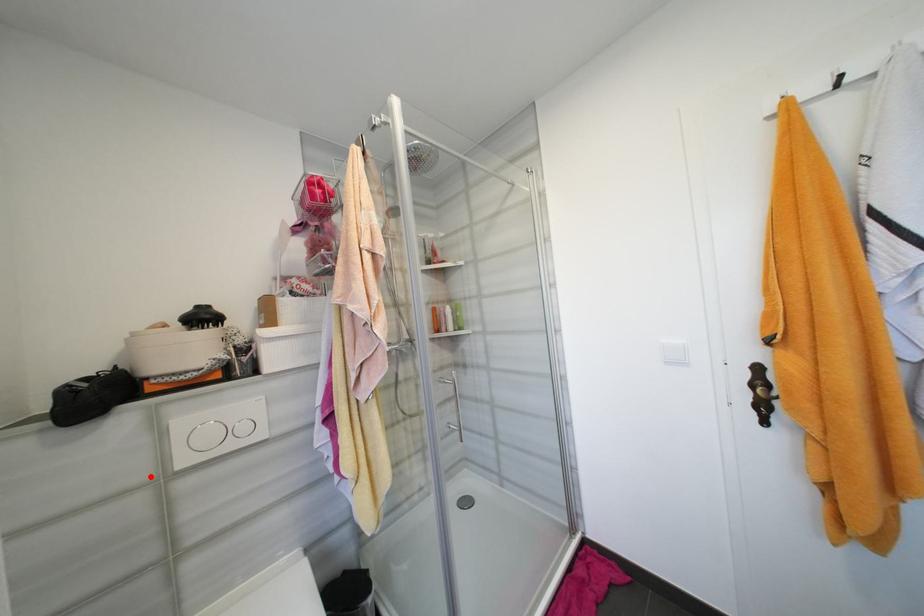
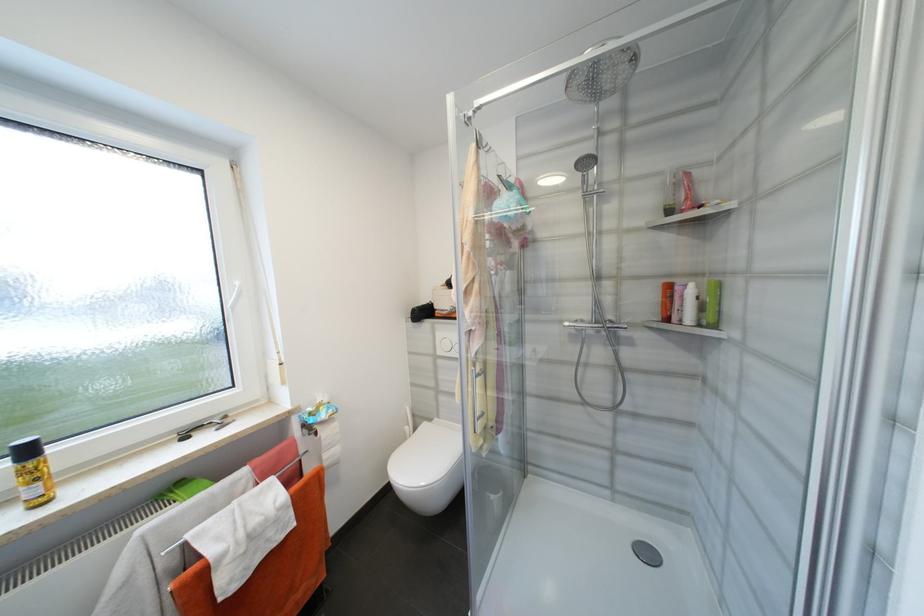
Question: I am providing you with two images of the same scene from different viewpoints. A red point is shown in image1. For the corresponding object point in image2, is it positioned nearer or farther from the camera?

Choices:
 (A) Nearer
 (B) Farther

Answer: (B)